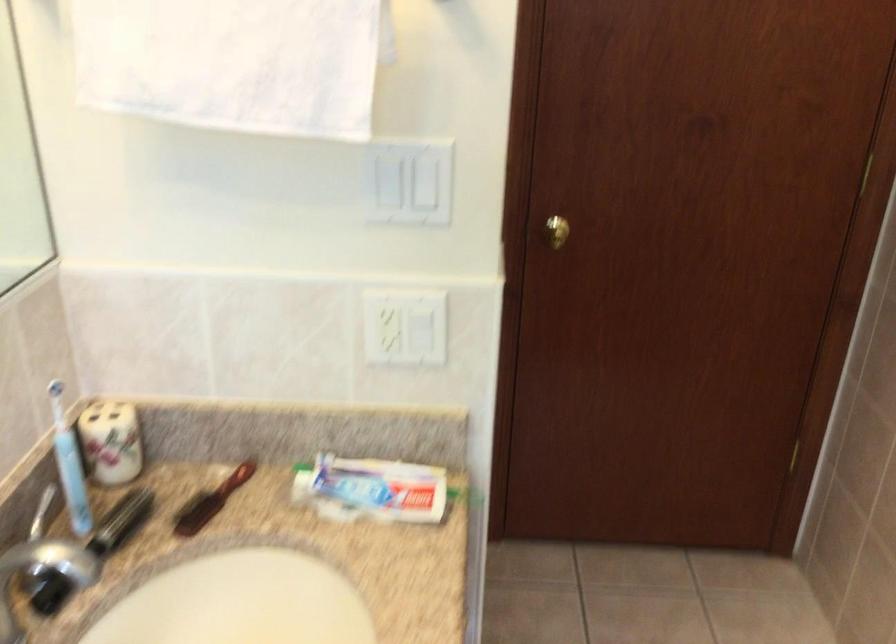
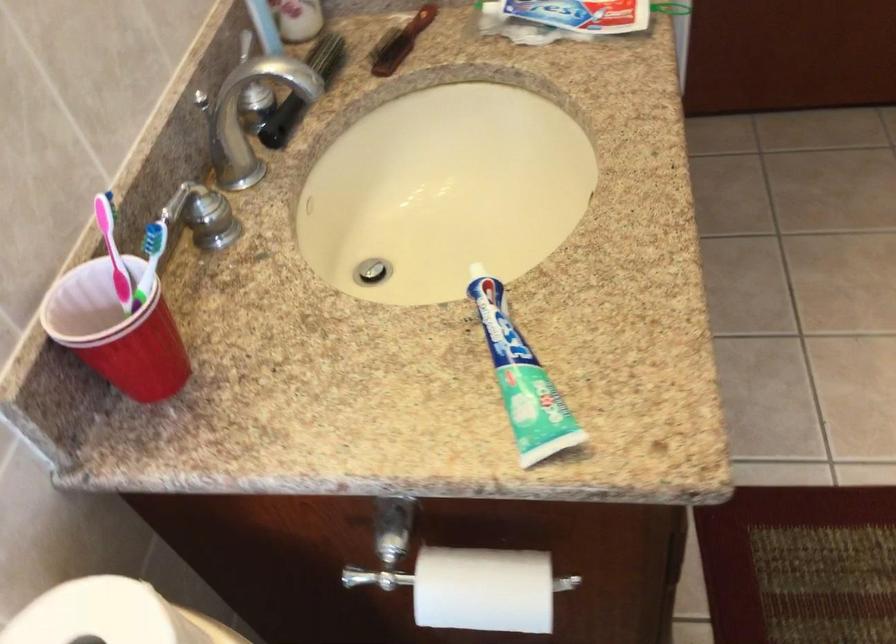
Find the pixel in the second image that matches point 205,504 in the first image.

(400, 42)